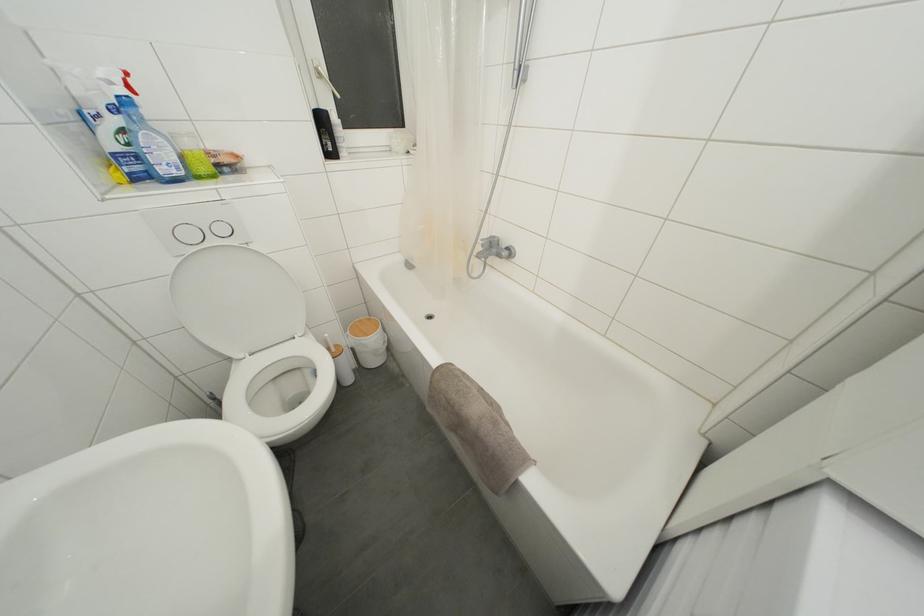
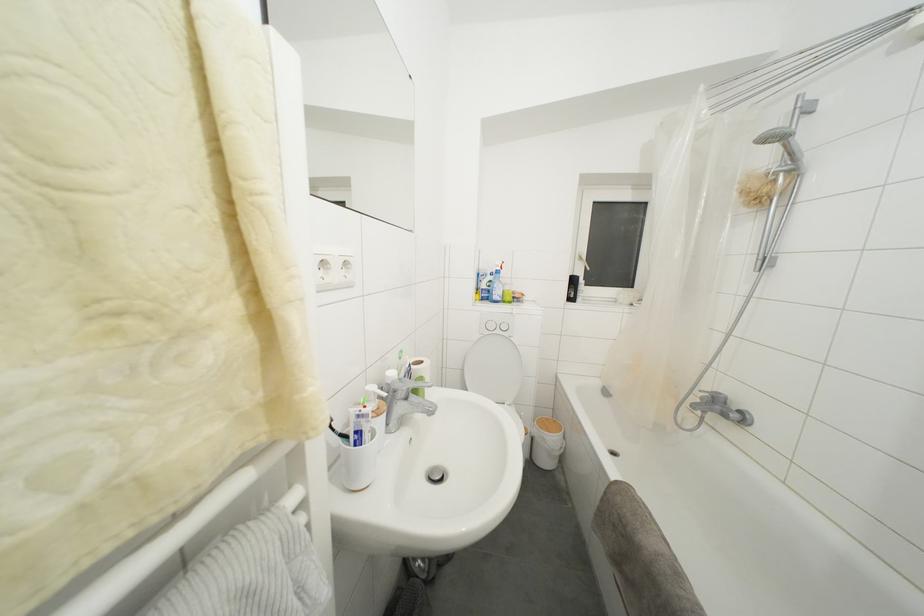
Find the pixel in the second image that matches the point at 141,175 in the first image.

(490, 301)